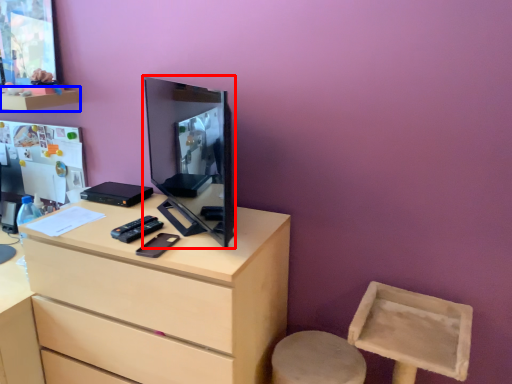
Question: Which object is closer to the camera taking this photo, computer monitor (highlighted by a red box) or shelf (highlighted by a blue box)?

Choices:
 (A) computer monitor
 (B) shelf

Answer: (A)